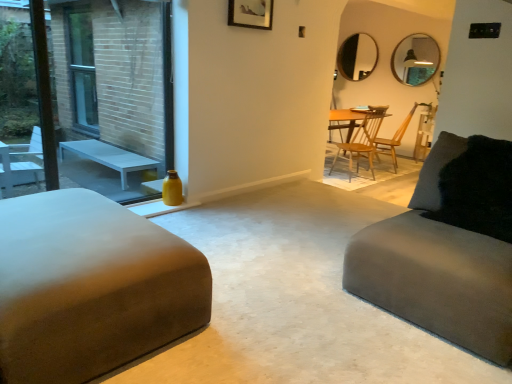
Question: From a real-world perspective, is matte black mirror at upper center, arranged as the 1th mirror when viewed from the left, over suede gray couch at right, marked as the 2th studio couch in a left-to-right arrangement?

Choices:
 (A) no
 (B) yes

Answer: (B)

Question: Does matte black mirror at upper center, arranged as the 1th mirror when viewed from the left, appear on the left side of suede gray couch at right, the 1th studio couch from the right?

Choices:
 (A) yes
 (B) no

Answer: (B)

Question: Is matte black mirror at upper center, which appears as the 2th mirror when viewed from the right, positioned before suede gray couch at right, the 1th studio couch from the right?

Choices:
 (A) no
 (B) yes

Answer: (A)

Question: From a real-world perspective, does matte black mirror at upper center, which appears as the 2th mirror when viewed from the right, sit lower than suede gray couch at right, marked as the 2th studio couch in a left-to-right arrangement?

Choices:
 (A) no
 (B) yes

Answer: (A)

Question: Is matte black mirror at upper center, marked as the first mirror in a back-to-front arrangement, taller than suede gray couch at right, the 1th studio couch from the right?

Choices:
 (A) no
 (B) yes

Answer: (B)

Question: From the image's perspective, is yellow glass bottle at left located above or below wooden chair at center, which is the second chair from right to left?

Choices:
 (A) below
 (B) above

Answer: (A)

Question: Considering the positions of yellow glass bottle at left and wooden chair at center, the first chair from the left, in the image, is yellow glass bottle at left taller or shorter than wooden chair at center, the first chair from the left,?

Choices:
 (A) tall
 (B) short

Answer: (A)

Question: Is yellow glass bottle at left spatially inside wooden chair at center, the first chair from the left, or outside of it?

Choices:
 (A) outside
 (B) inside

Answer: (A)

Question: From a real-world perspective, is yellow glass bottle at left above or below wooden chair at center, which is the second chair from right to left?

Choices:
 (A) below
 (B) above

Answer: (B)

Question: Based on their positions, is matte black mirror at upper right, the second mirror positioned from the left, located to the left or right of matte silver picture frame at upper center?

Choices:
 (A) left
 (B) right

Answer: (B)

Question: Is matte black mirror at upper right, the 1th mirror viewed from the right, inside or outside of matte silver picture frame at upper center?

Choices:
 (A) inside
 (B) outside

Answer: (B)

Question: From the image's perspective, is matte black mirror at upper right, the 1th mirror viewed from the right, above or below matte silver picture frame at upper center?

Choices:
 (A) above
 (B) below

Answer: (A)

Question: From a real-world perspective, relative to matte silver picture frame at upper center, is matte black mirror at upper right, the 1th mirror viewed from the right, vertically above or below?

Choices:
 (A) above
 (B) below

Answer: (B)

Question: Considering the relative positions of wooden chair at center, which ranks as the first chair in right-to-left order, and black fuzzy pillow at right in the image provided, is wooden chair at center, which ranks as the first chair in right-to-left order, to the left or to the right of black fuzzy pillow at right?

Choices:
 (A) right
 (B) left

Answer: (A)

Question: Is point (390, 148) positioned closer to the camera than point (444, 195)?

Choices:
 (A) closer
 (B) farther

Answer: (B)